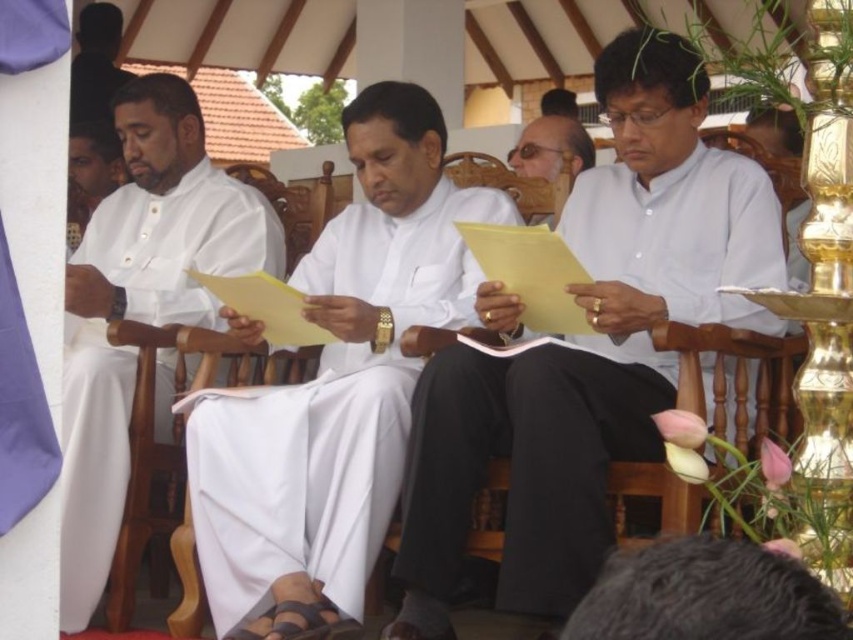
Does white matte shirt at center have a lesser height compared to white cloth at center?

Yes, white matte shirt at center is shorter than white cloth at center.

Does white matte shirt at center have a smaller size compared to white cloth at center?

Correct, white matte shirt at center occupies less space than white cloth at center.

Is point (538, 534) closer to camera compared to point (271, 529)?

Yes, point (538, 534) is closer to viewer.

Locate an element on the screen. white matte shirt at center is located at coordinates (589, 348).

Can you confirm if white matte shirt at center is positioned to the right of matte white paper at center?

Incorrect, white matte shirt at center is not on the right side of matte white paper at center.

Can you confirm if white matte shirt at center is positioned to the left of matte white paper at center?

Correct, you'll find white matte shirt at center to the left of matte white paper at center.

This screenshot has height=640, width=853. In order to click on white matte shirt at center in this screenshot , I will do `click(589, 348)`.

Can you confirm if white matte shirt at center is taller than wooden chair at center?

Incorrect, white matte shirt at center's height is not larger of wooden chair at center's.

Find the location of a particular element. white matte shirt at center is located at coordinates (589, 348).

What do you see at coordinates (589, 348) in the screenshot? I see `white matte shirt at center` at bounding box center [589, 348].

Locate an element on the screen. The image size is (853, 640). white matte shirt at center is located at coordinates (589, 348).